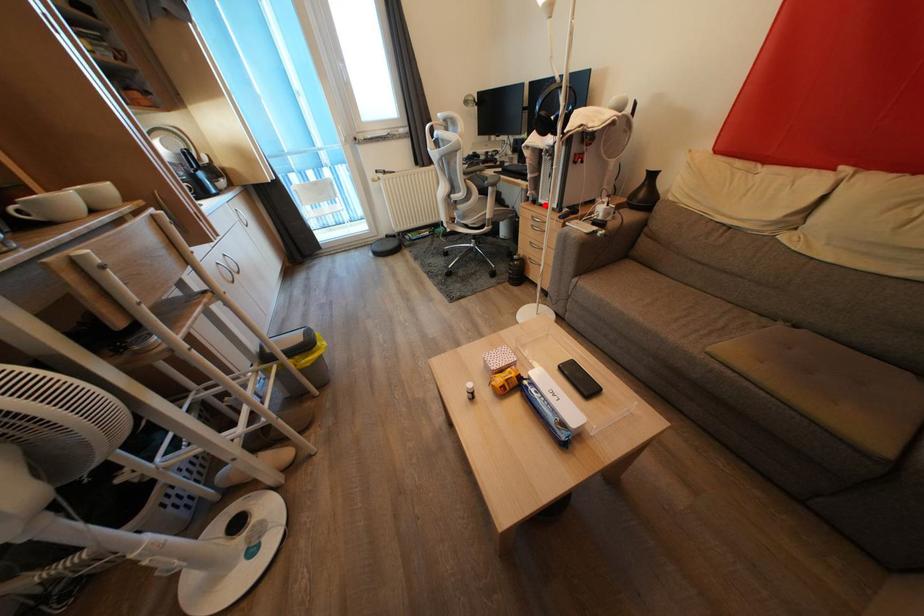
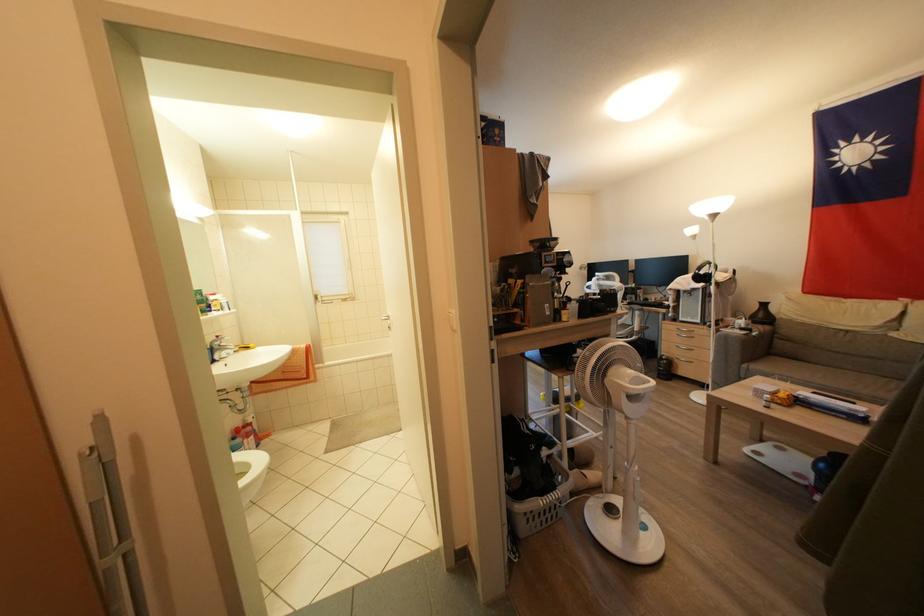
In the second image, find the point that corresponds to the highlighted location in the first image.

(686, 323)